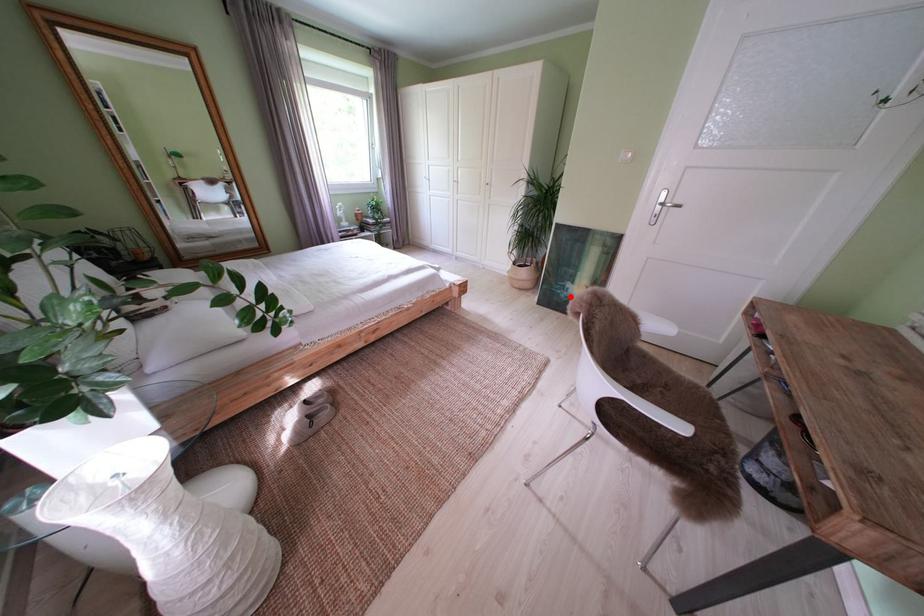
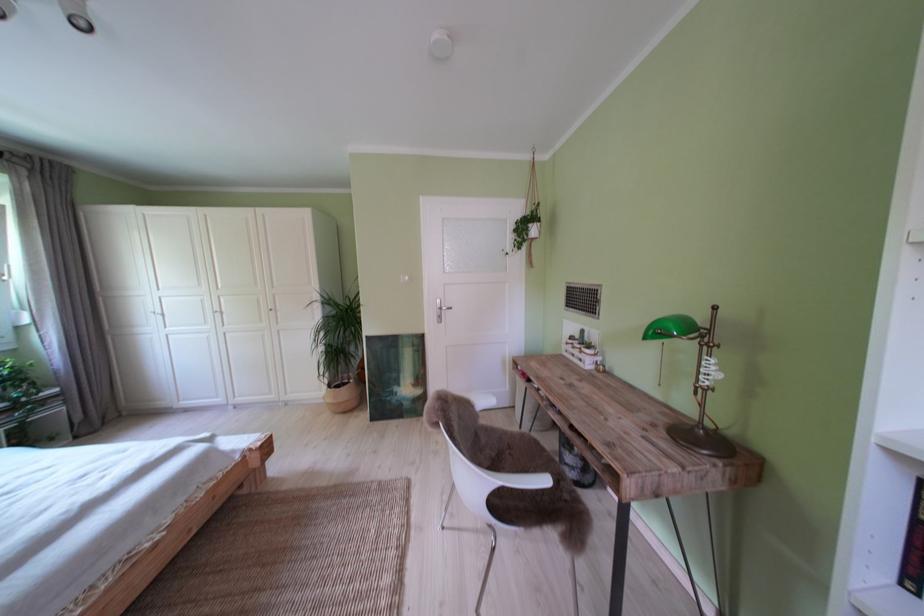
The point at the highlighted location is marked in the first image. Where is the corresponding point in the second image?

(399, 403)